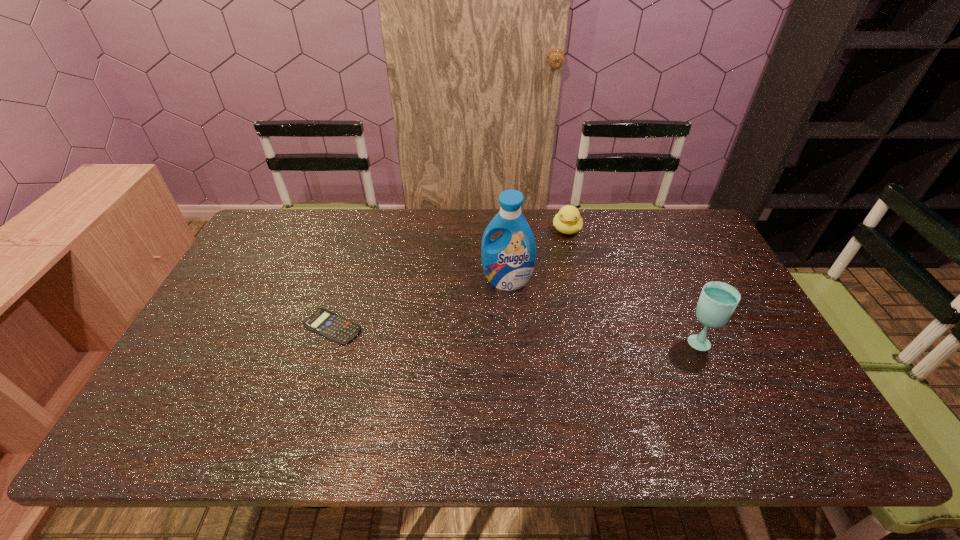
I want to click on the leftmost object, so click(328, 324).

At what (x,y) coordinates should I click in order to perform the action: click on the shortest object. Please return your answer as a coordinate pair (x, y). Looking at the image, I should click on (328, 324).

What are the coordinates of `the third shortest object` in the screenshot? It's located at (718, 300).

Where is `the rightmost object`? the rightmost object is located at coordinates click(718, 300).

At what (x,y) coordinates should I click in order to perform the action: click on the farthest object. Please return your answer as a coordinate pair (x, y). Image resolution: width=960 pixels, height=540 pixels. Looking at the image, I should click on (568, 220).

Find the location of a particular element. This screenshot has height=540, width=960. the third tallest object is located at coordinates (568, 220).

The width and height of the screenshot is (960, 540). I want to click on the second object from left to right, so click(508, 262).

In order to click on the third nearest object in this screenshot , I will do `click(508, 262)`.

The height and width of the screenshot is (540, 960). I want to click on free location located on the left of the calculator, so click(241, 327).

Find the location of a particular element. Image resolution: width=960 pixels, height=540 pixels. vacant point located on the left of the second tallest object is located at coordinates (551, 340).